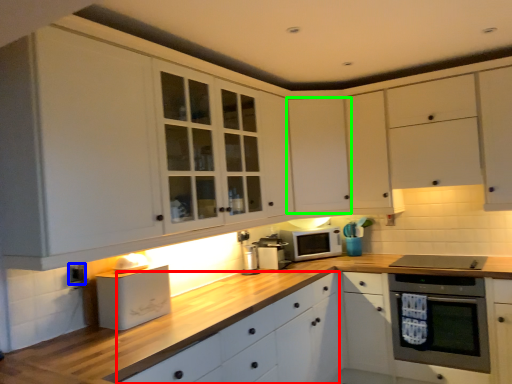
Question: Which object is positioned farthest from drawer (highlighted by a red box)? Select from electric outlet (highlighted by a blue box) and cabinetry (highlighted by a green box).

Choices:
 (A) electric outlet
 (B) cabinetry

Answer: (A)